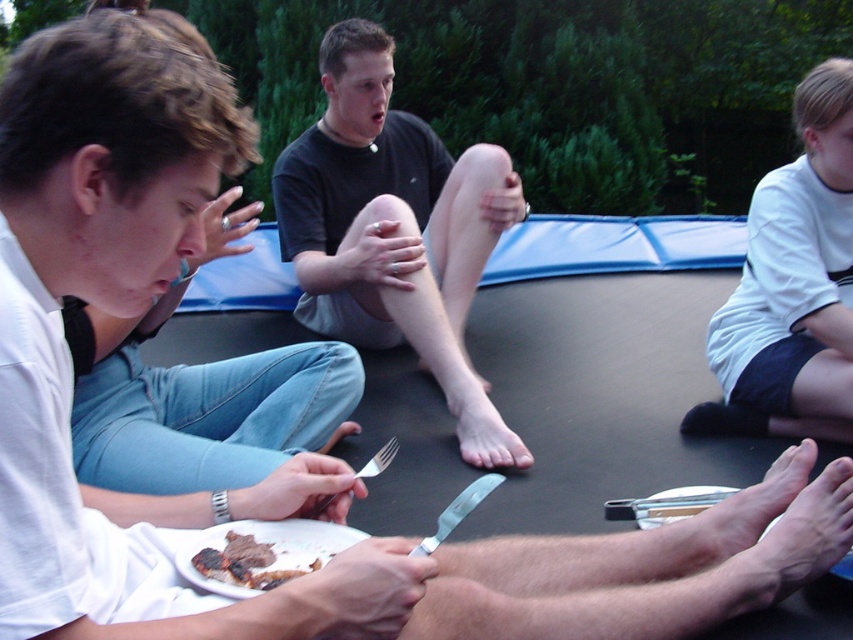
You are standing at the center of the trampoline and want to hand a snack to the person wearing the white cotton shirt at upper right. In which direction should you move to reach them?

The white cotton shirt at upper right is located at point 0.447 on the x and 0.930 on the y coordinates. Since you are at the center, you should move towards the upper right direction to reach them.

You are standing at the edge of the trampoline and want to hand a snack to the person wearing the black matte shirt at center. Based on their position, where should you aim to throw the snack?

The black matte shirt at center is located at point 0.361 on the x and 0.463 on the y coordinates, so you should aim towards those coordinates to reach them.

You are standing at the point marked by the coordinates point (833, 176). You want to throw a ball to a friend who is 7.12 feet away from you. Is the distance within the typical throwing range for a child aged 8?

The distance between you and your friend is 7.12 feet. Since an 8 year old can typically throw a ball up to around 15 feet, the distance is within the typical throwing range for an 8 year old.